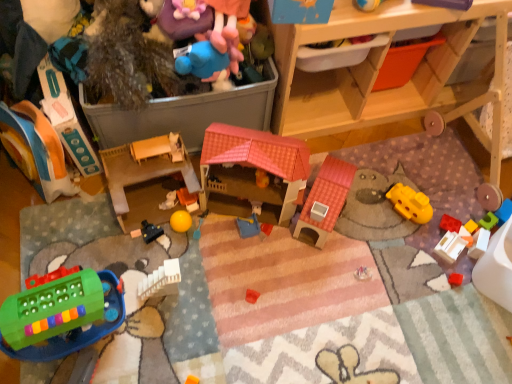
Image resolution: width=512 pixels, height=384 pixels. What are the coordinates of `vacant space situated on the left part of white plastic toy at lower right, which is counted as the tenth toy, starting from the left` in the screenshot? It's located at (400, 246).